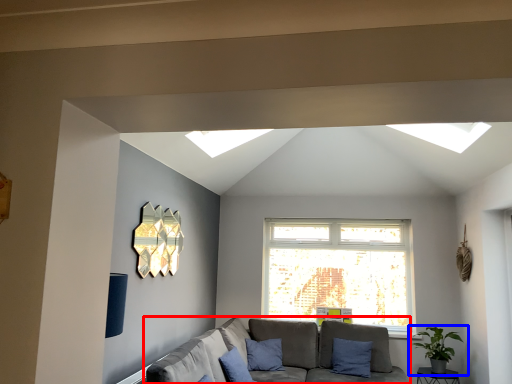
Question: Which object is closer to the camera taking this photo, studio couch (highlighted by a red box) or houseplant (highlighted by a blue box)?

Choices:
 (A) studio couch
 (B) houseplant

Answer: (A)